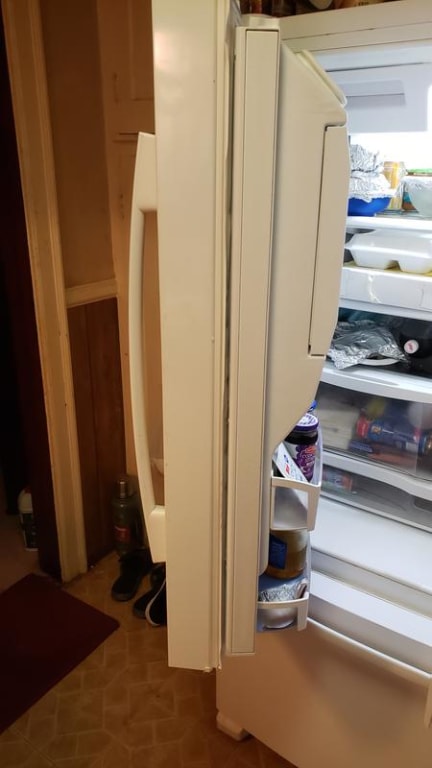
Locate an element on the screen. Image resolution: width=432 pixels, height=768 pixels. thermos is located at coordinates (119, 521).